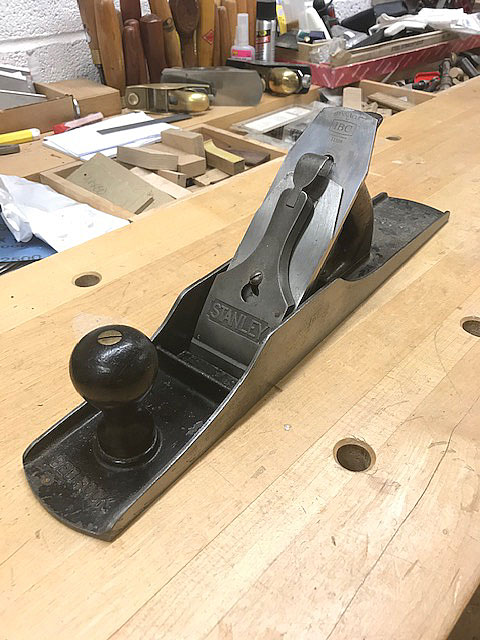
The height and width of the screenshot is (640, 480). What are the coordinates of `metal bulb` in the screenshot? It's located at (112, 368).